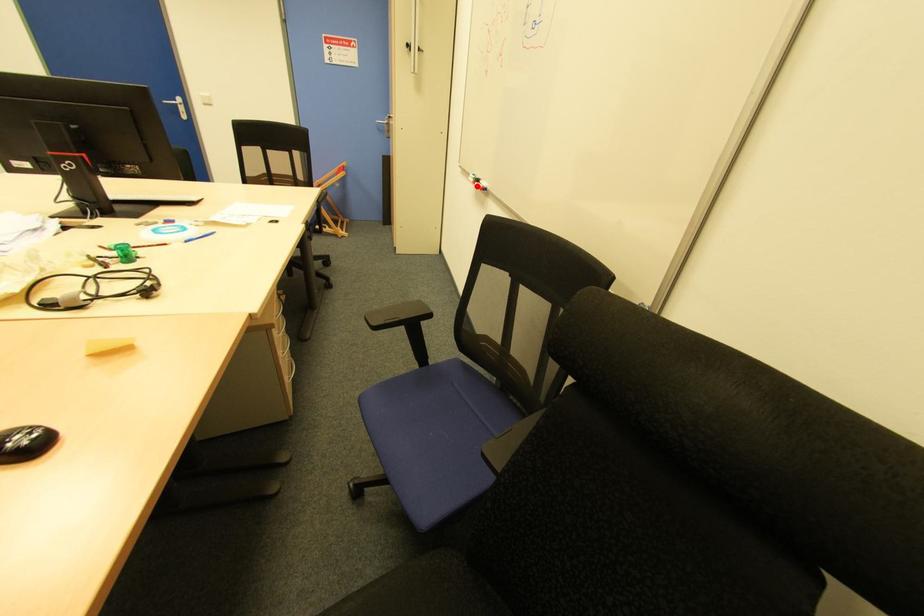
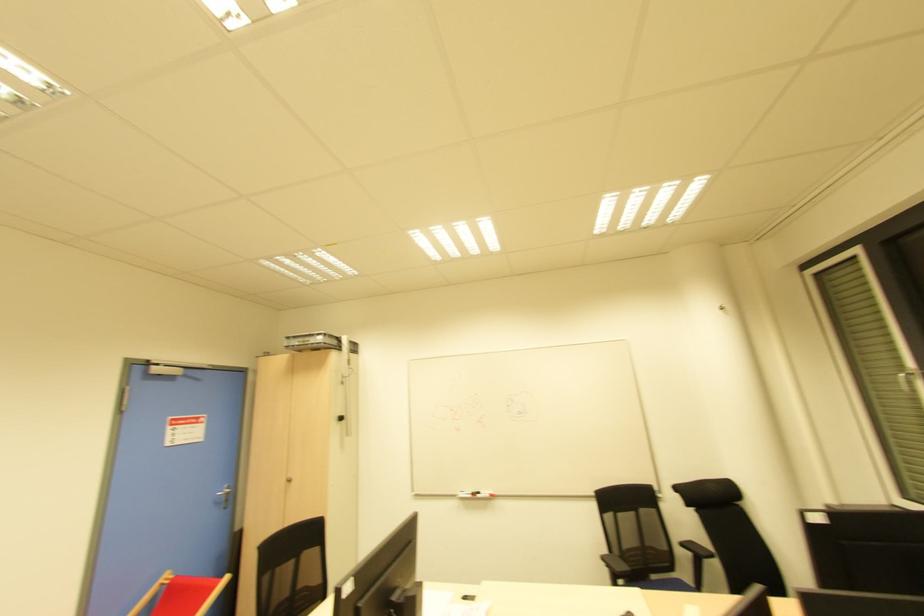
Find the pixel in the second image that matches the highlighted location in the first image.

(478, 496)